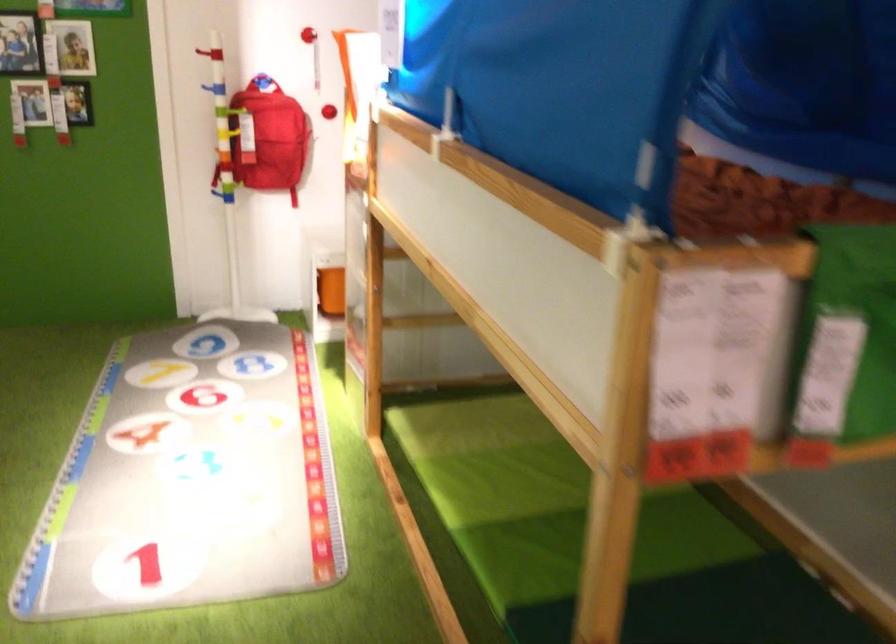
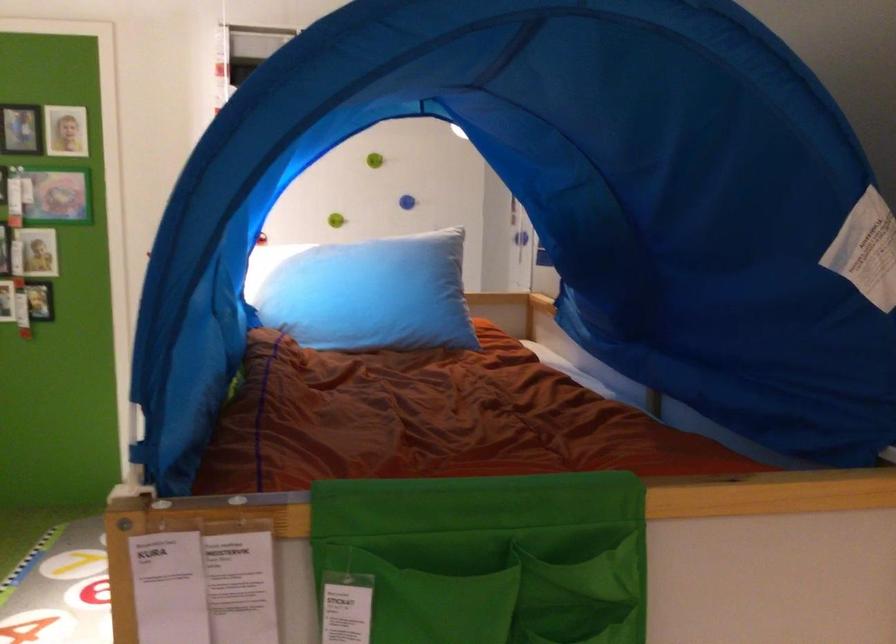
Question: What movement of the cameraman would produce the second image?

Choices:
 (A) Left
 (B) Right
 (C) Forward
 (D) Backward

Answer: (B)